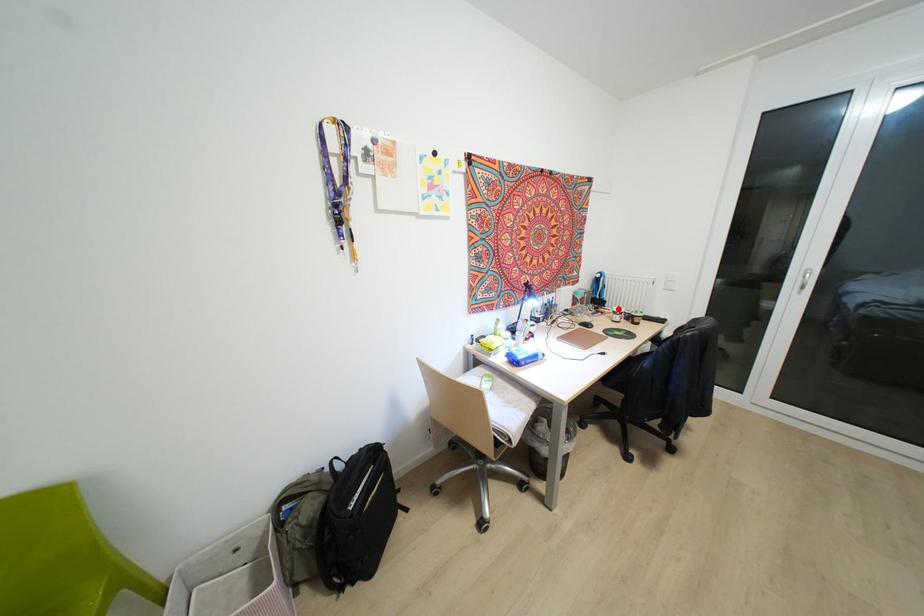
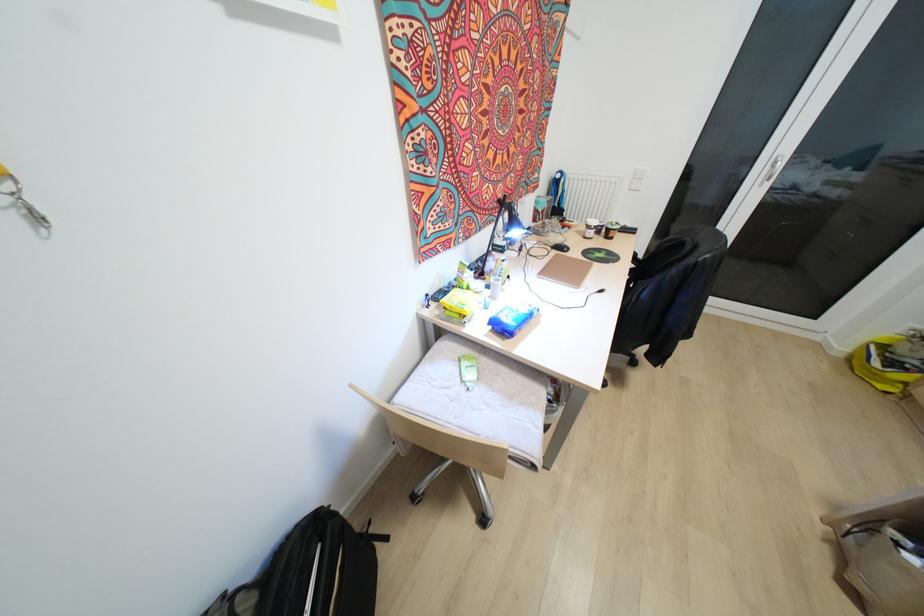
Where in the second image is the point corresponding to the highlighted location from the first image?

(592, 222)